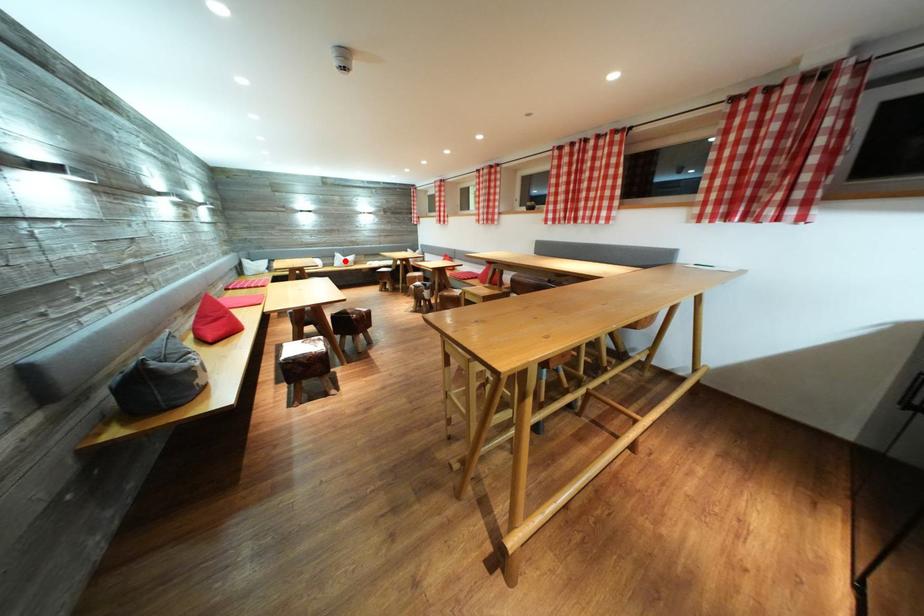
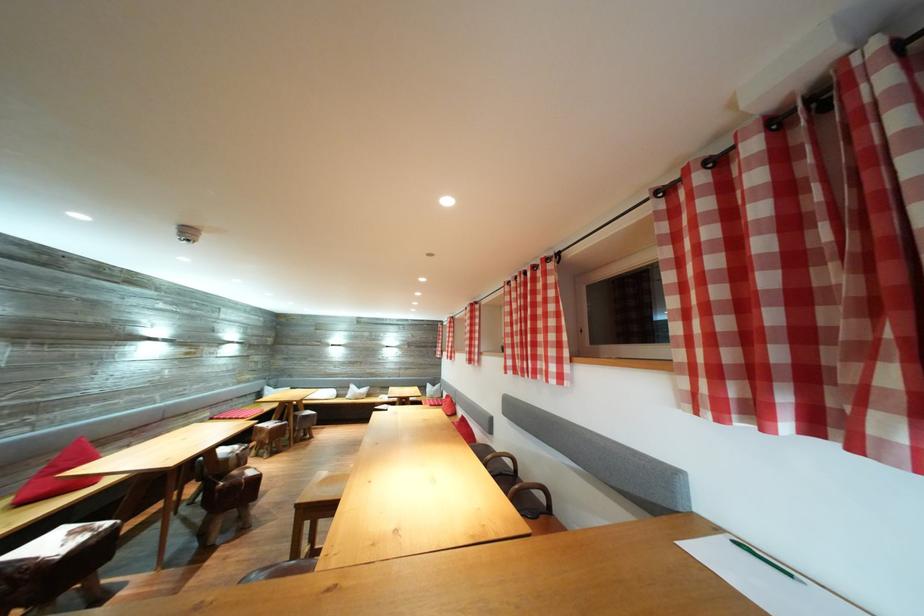
The point at the highlighted location is marked in the first image. Where is the corresponding point in the second image?

(359, 392)